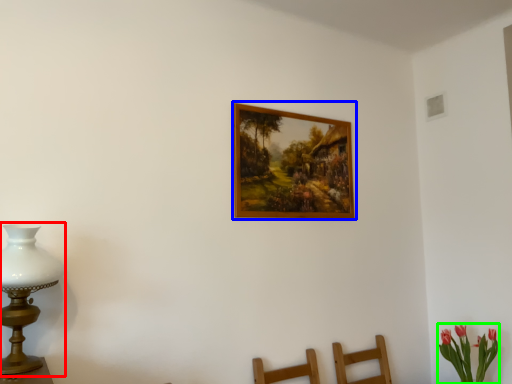
Question: Which object is positioned closest to table lamp (highlighted by a red box)? Select from picture frame (highlighted by a blue box) and floral arrangement (highlighted by a green box).

Choices:
 (A) picture frame
 (B) floral arrangement

Answer: (A)